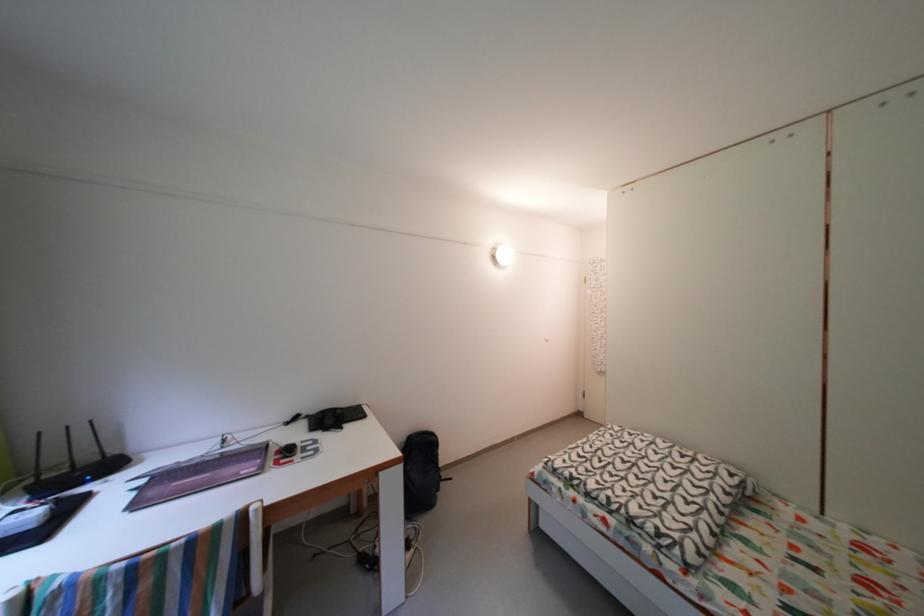
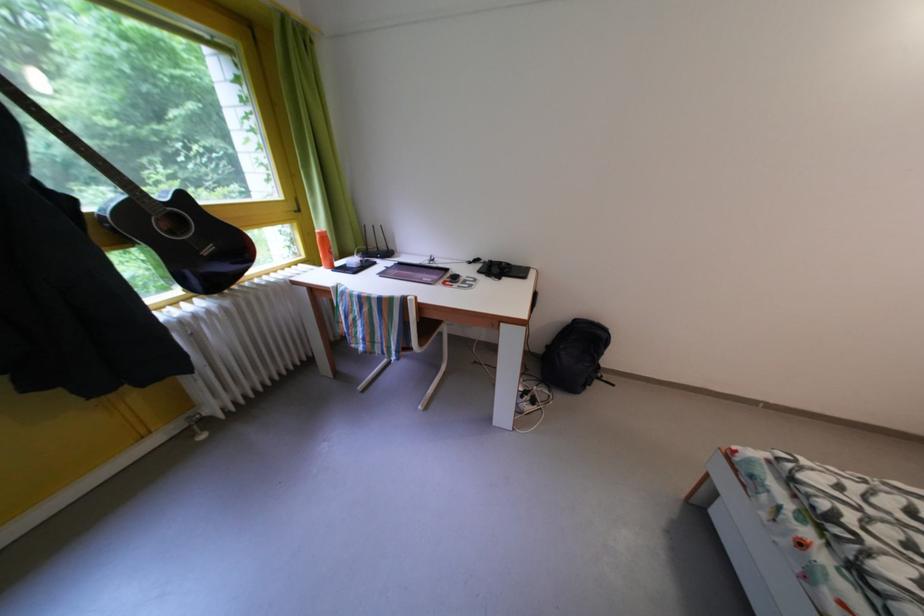
First-person continuous shooting, in which direction is the camera rotating?

The camera's rotation is toward left-down.